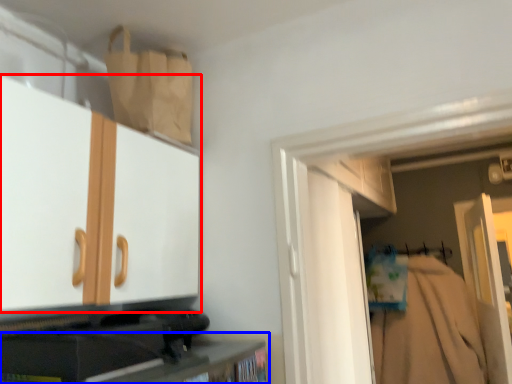
Question: Which of the following is the closest to the observer, cabinetry (highlighted by a red box) or cabinetry (highlighted by a blue box)?

Choices:
 (A) cabinetry
 (B) cabinetry

Answer: (A)